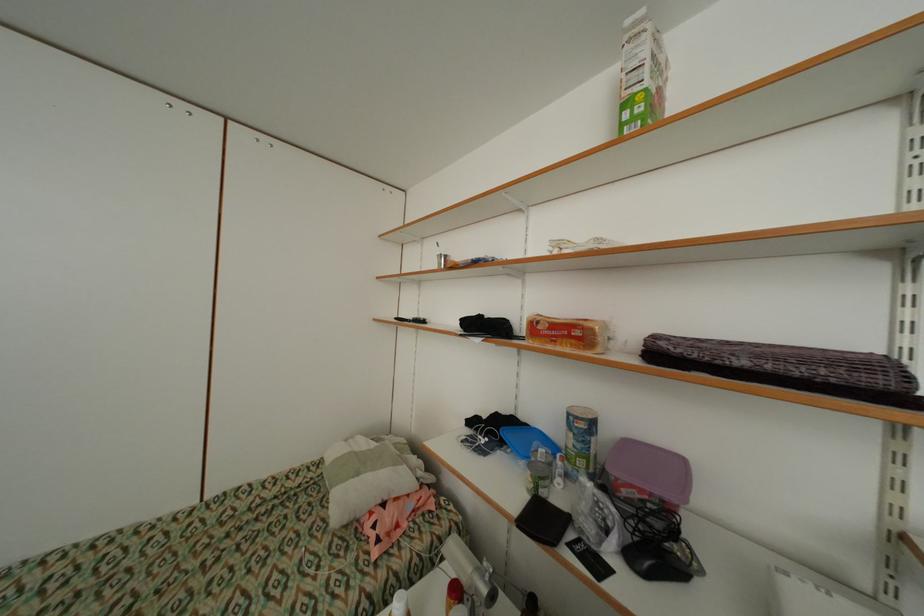
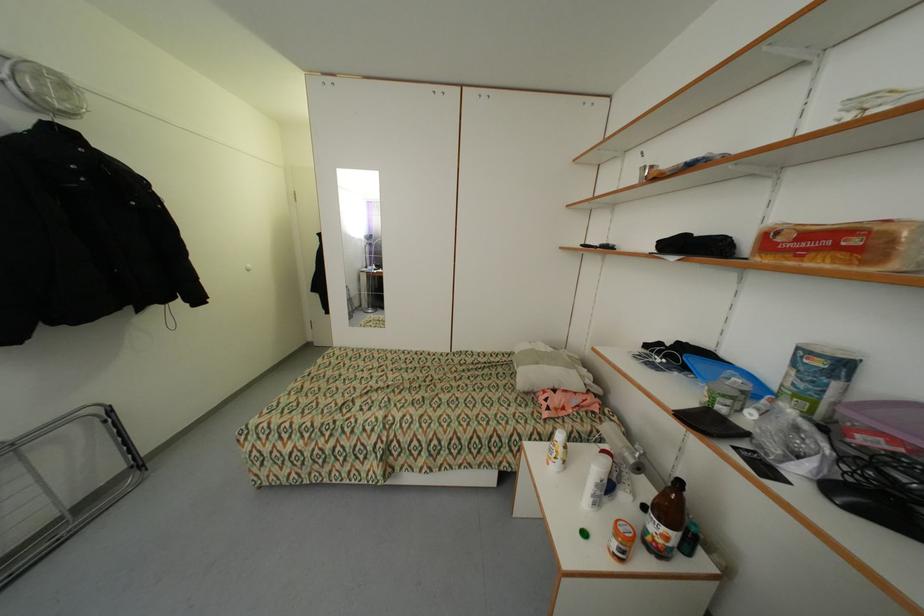
Question: Based on the continuous images, in which direction is the camera rotating? Reply with the corresponding letter.

Choices:
 (A) Left
 (B) Right
 (C) Up
 (D) Down

Answer: (A)